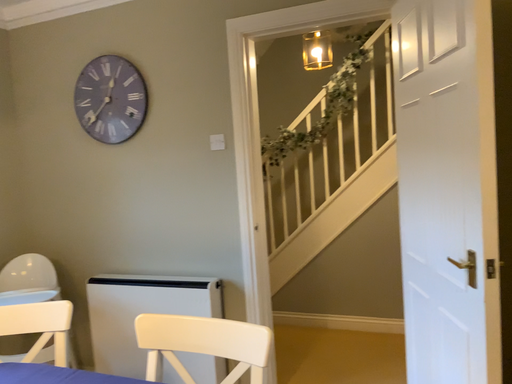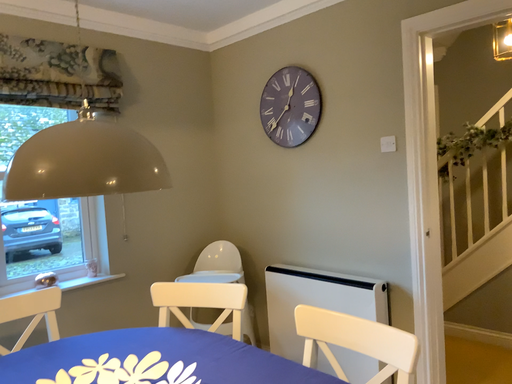
Question: Which way did the camera rotate in the video?

Choices:
 (A) rotated left
 (B) rotated right

Answer: (A)